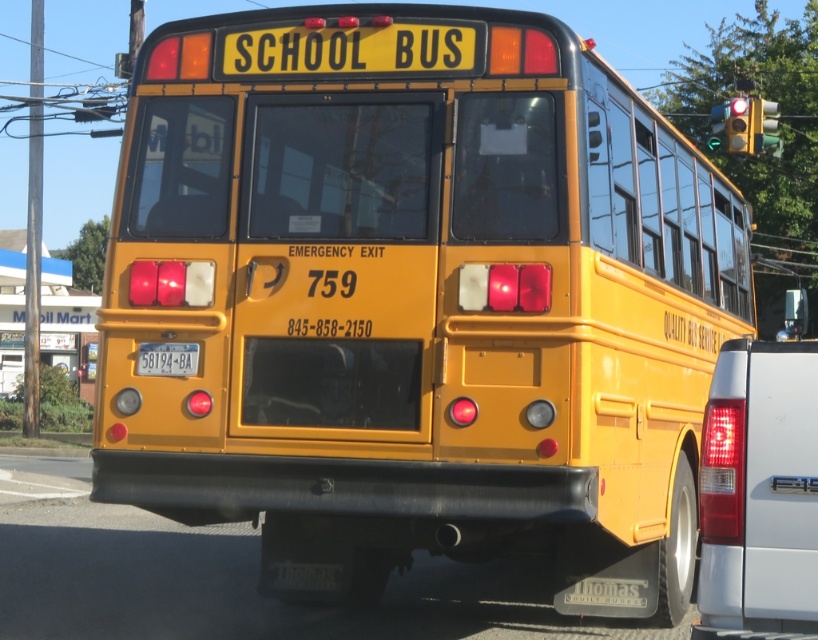
Question: Among these points, which one is nearest to the camera?

Choices:
 (A) (751, 592)
 (B) (138, 353)

Answer: (A)

Question: Is matte white tail light at rear below yellow plastic license plate at center?

Choices:
 (A) yes
 (B) no

Answer: (A)

Question: Does matte white tail light at rear appear over yellow plastic license plate at center?

Choices:
 (A) no
 (B) yes

Answer: (A)

Question: Does matte white tail light at rear appear on the left side of yellow plastic license plate at center?

Choices:
 (A) yes
 (B) no

Answer: (B)